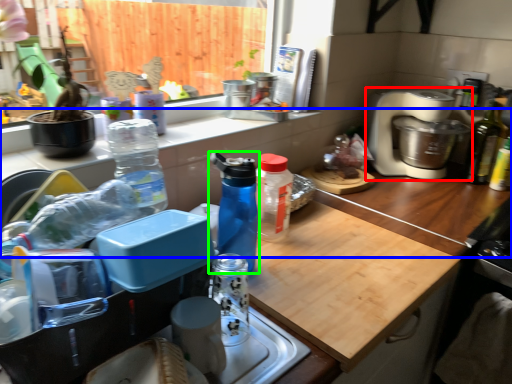
Question: Which object is the closest to the home appliance (highlighted by a red box)? Choose among these: countertop (highlighted by a blue box) or bottle (highlighted by a green box).

Choices:
 (A) countertop
 (B) bottle

Answer: (A)